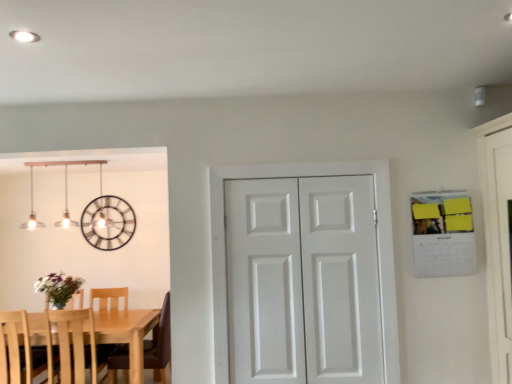
Image resolution: width=512 pixels, height=384 pixels. Identify the location of free space above white matte door at center (from a real-world perspective). (304, 166).